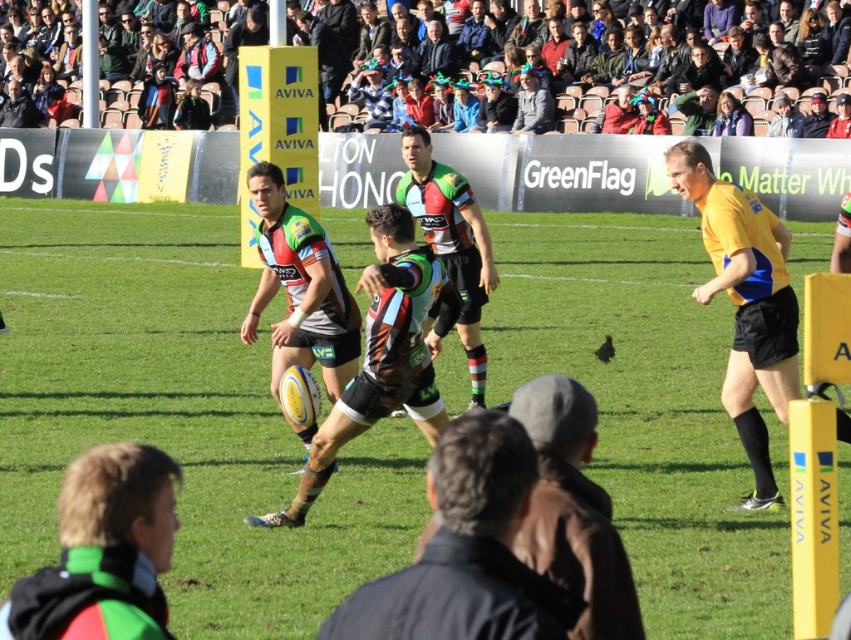
Question: Is yellow jersey at right wider than dark brown leather jacket at center?

Choices:
 (A) yes
 (B) no

Answer: (A)

Question: Which is nearer to the matte rugby ball at center?

Choices:
 (A) light gray sweater at upper center
 (B) black jersey at center

Answer: (B)

Question: Does yellow jersey at right appear over multicolored fabric crowd at upper center?

Choices:
 (A) no
 (B) yes

Answer: (A)

Question: Which of the following is the farthest from the observer?

Choices:
 (A) (467, 193)
 (B) (384, 408)
 (C) (184, 280)

Answer: (C)

Question: Which of the following is the closest to the observer?

Choices:
 (A) green fabric jacket at lower left
 (B) light gray sweater at upper center
 (C) dark brown leather jacket at center

Answer: (A)

Question: Is matte rugby ball at center above camouflage jersey at center?

Choices:
 (A) no
 (B) yes

Answer: (B)